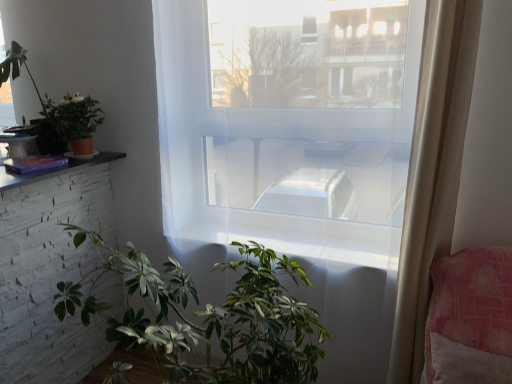
Question: Considering their positions, is green matte plant at upper left, positioned as the second houseplant in top-to-bottom order, located in front of or behind green matte plant at lower center, acting as the first houseplant starting from the bottom?

Choices:
 (A) behind
 (B) front

Answer: (A)

Question: From a real-world perspective, is green matte plant at upper left, positioned as the second houseplant in top-to-bottom order, physically located above or below green matte plant at lower center, which is counted as the 3th houseplant, starting from the left?

Choices:
 (A) below
 (B) above

Answer: (B)

Question: Which object is positioned closest to the transparent glass window at center?

Choices:
 (A) green matte plant at upper left, positioned as the second houseplant in top-to-bottom order
 (B) matte white table at left
 (C) green matte plant at upper left, which is the 1th houseplant in top-to-bottom order
 (D) green matte plant at lower center, acting as the third houseplant starting from the top

Answer: (D)

Question: Which object is positioned closest to the green matte plant at upper left, placed as the second houseplant when sorted from bottom to top?

Choices:
 (A) green matte plant at upper left, the 3th houseplant in the right-to-left sequence
 (B) transparent glass window at center
 (C) green matte plant at lower center, acting as the first houseplant starting from the bottom
 (D) matte white table at left

Answer: (A)